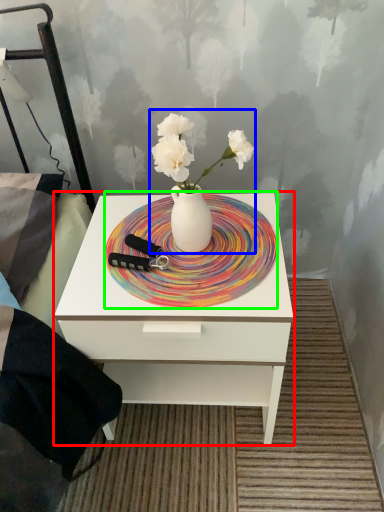
Question: Considering the real-world distances, which object is closest to nightstand (highlighted by a red box)? floral arrangement (highlighted by a blue box) or plate (highlighted by a green box).

Choices:
 (A) floral arrangement
 (B) plate

Answer: (B)